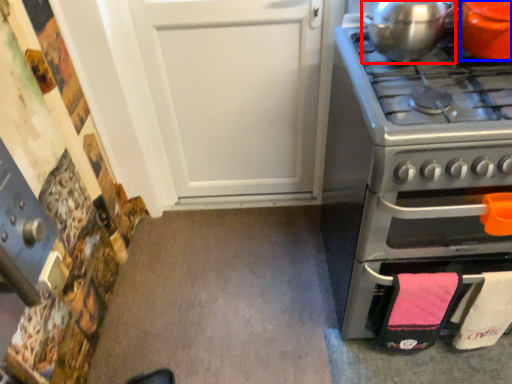
Question: Which of the following is the farthest to the observer, kitchen appliance (highlighted by a red box) or kitchen appliance (highlighted by a blue box)?

Choices:
 (A) kitchen appliance
 (B) kitchen appliance

Answer: (A)